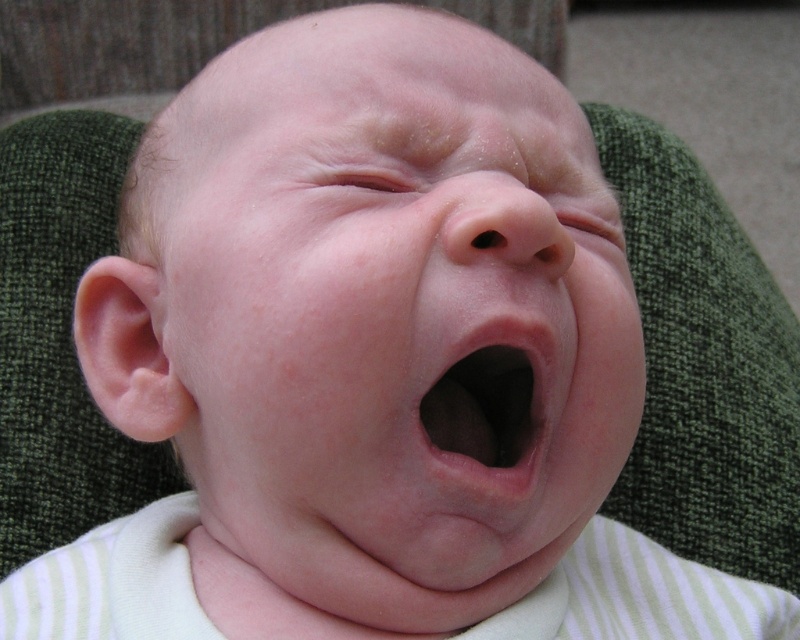
Question: Is pink smooth skin at center to the right of pink flesh/yellowish skin at center from the viewer's perspective?

Choices:
 (A) no
 (B) yes

Answer: (A)

Question: Can you confirm if pink smooth skin at center is positioned above pink flesh/yellowish skin at center?

Choices:
 (A) no
 (B) yes

Answer: (B)

Question: Which of the following is the closest to the observer?

Choices:
 (A) pink smooth skin at center
 (B) pink flesh/yellowish skin at center

Answer: (A)

Question: Is pink smooth skin at center positioned in front of pink flesh/yellowish skin at center?

Choices:
 (A) yes
 (B) no

Answer: (A)